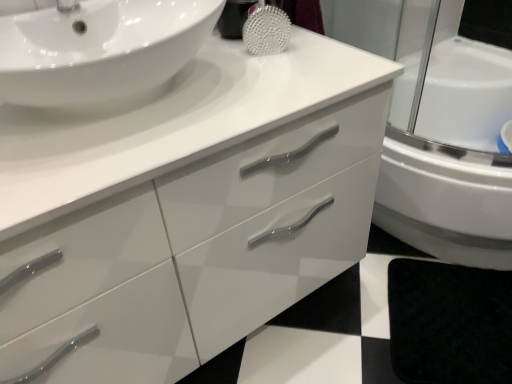
You are a GUI agent. You are given a task and a screenshot of the screen. Output one action in this format:
    pyautogui.click(x=<x>, y=<y>)
    Task: Click on the vacant position to the left of black matte bath mat at lower right
    
    Given the screenshot: What is the action you would take?
    [x=339, y=326]